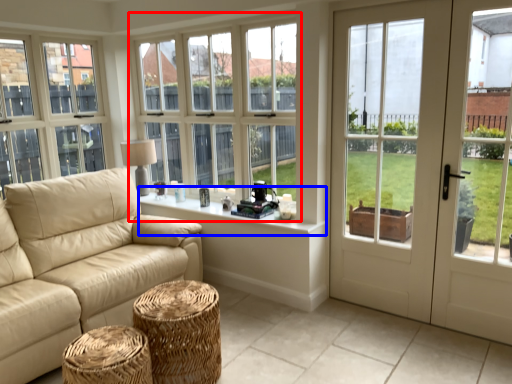
Question: Which object is further to the camera taking this photo, window (highlighted by a red box) or window sill (highlighted by a blue box)?

Choices:
 (A) window
 (B) window sill

Answer: (A)